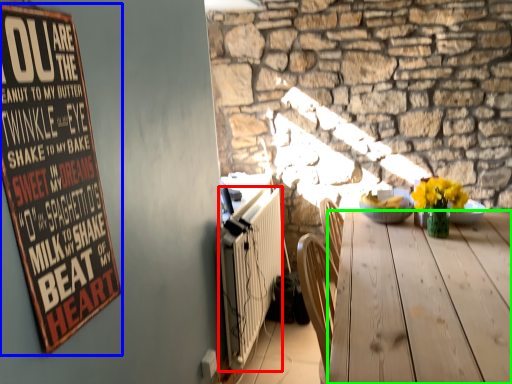
Question: Which object is the farthest from radiator (highlighted by a red box)? Choose among these: bulletin board (highlighted by a blue box) or desk (highlighted by a green box).

Choices:
 (A) bulletin board
 (B) desk

Answer: (A)